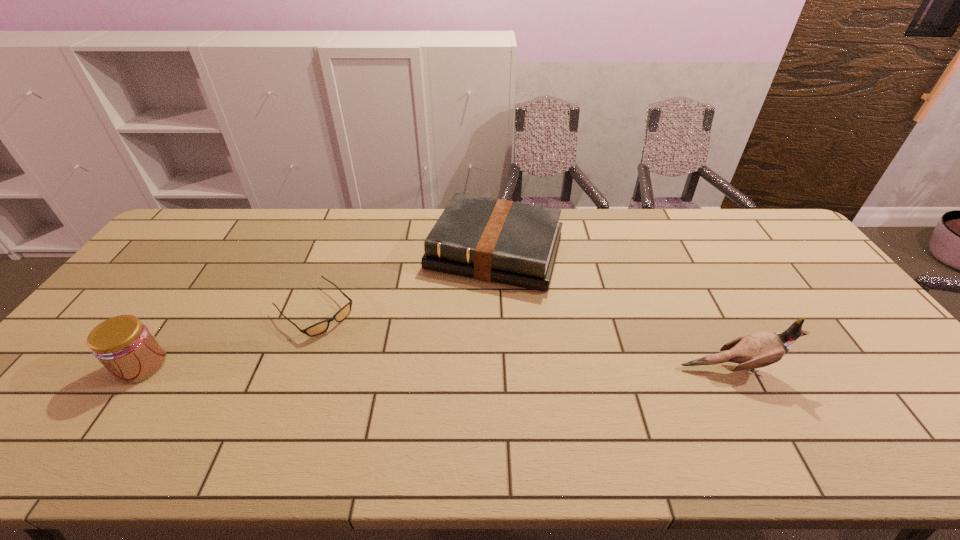
Identify the location of vacant space at the far edge of the desktop. Image resolution: width=960 pixels, height=540 pixels. (321, 213).

Find the location of `free space at the left edge`. free space at the left edge is located at coordinates (170, 259).

In the image, there is a desktop. Where is `vacant space at the right edge`? The height and width of the screenshot is (540, 960). vacant space at the right edge is located at coordinates (850, 327).

Where is `vacant area at the far left corner`? This screenshot has width=960, height=540. vacant area at the far left corner is located at coordinates (202, 212).

Image resolution: width=960 pixels, height=540 pixels. What are the coordinates of `vacant space at the far right corner` in the screenshot? It's located at (750, 234).

Find the location of a particular element. vacant space at the near right corner is located at coordinates (867, 400).

Find the location of a particular element. Image resolution: width=960 pixels, height=540 pixels. vacant space that is in between the jam and the hardback book is located at coordinates (318, 308).

Identify the location of blank region between the tallest object and the hardback book. The width and height of the screenshot is (960, 540). (613, 310).

I want to click on blank region between the jam and the second object from left to right, so click(x=228, y=338).

Locate an element on the screen. free space between the jam and the sunglasses is located at coordinates (228, 338).